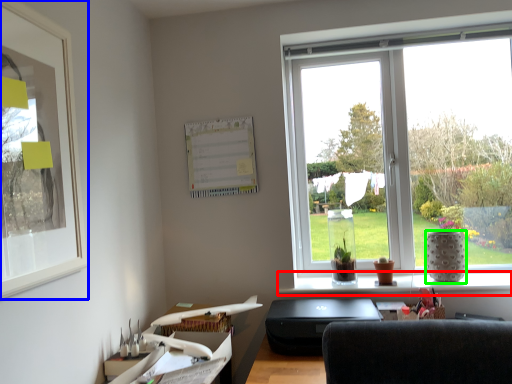
Question: Estimate the real-world distances between objects in this image. Which object is closer to window sill (highlighted by a red box), picture frame (highlighted by a blue box) or vase (highlighted by a green box)?

Choices:
 (A) picture frame
 (B) vase

Answer: (B)